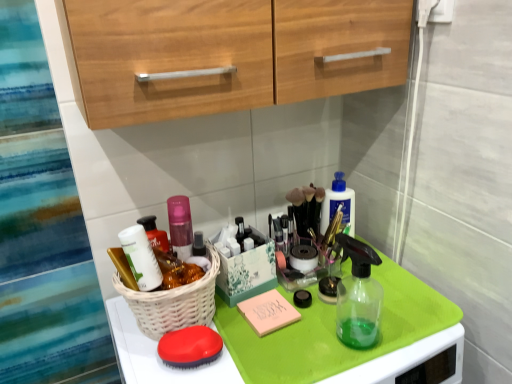
Identify the location of white wicker basket at center. (173, 303).

Measure the distance between point (145, 286) and camera.

Point (145, 286) and camera are 29.17 inches apart from each other.

In order to face matte white container at center left, should I rotate leftwards or rightwards?

To face it directly, rotate left by 15.046 degrees.

Identify the location of white wicker basket at center. The image size is (512, 384). (173, 303).

From a real-world perspective, is matte red brush at lower center physically below matte white container at center left?

Yes, from a real-world perspective, matte red brush at lower center is under matte white container at center left.

Where is `soap below the matte white container at center left (from the image's perspective)`? The height and width of the screenshot is (384, 512). soap below the matte white container at center left (from the image's perspective) is located at coordinates (190, 347).

Which of these two, matte red brush at lower center or matte white container at center left, stands taller?

matte white container at center left is taller.

Is matte red brush at lower center thinner than matte white container at center left?

No.

Who is taller, matte red brush at lower center or white wicker basket at center?

Standing taller between the two is white wicker basket at center.

Is matte red brush at lower center smaller than white wicker basket at center?

Correct, matte red brush at lower center occupies less space than white wicker basket at center.

Which is further, [189,349] or [155,316]?

The point [155,316] is behind.

Find the location of a particular element. Image resolution: width=512 pixels, height=384 pixels. basket that is on the left side of matte red brush at lower center is located at coordinates (173, 303).

Is matte white container at center left facing towards matte red brush at lower center?

No, matte white container at center left is not oriented towards matte red brush at lower center.

Considering the relative sizes of matte white container at center left and matte red brush at lower center in the image provided, is matte white container at center left bigger than matte red brush at lower center?

Yes.

You are a GUI agent. You are given a task and a screenshot of the screen. Output one action in this format:
    pyautogui.click(x=<x>, y=<y>)
    Task: Click on the soap that is on the right side of matte white container at center left
    
    Given the screenshot: What is the action you would take?
    pyautogui.click(x=190, y=347)

Measure the distance between matte white container at center left and matte red brush at lower center.

matte white container at center left and matte red brush at lower center are 5.28 inches apart from each other.

Which point is more distant from viewer, (157,339) or (142,275)?

The point (157,339) is farther from the camera.

Which object is more forward, white wicker basket at center or matte white container at center left?

white wicker basket at center is in front.

Is white wicker basket at center beside matte white container at center left?

Yes, white wicker basket at center and matte white container at center left clearly make contact.

Considering the sizes of objects white wicker basket at center and matte white container at center left in the image provided, who is taller, white wicker basket at center or matte white container at center left?

matte white container at center left is taller.

From the image's perspective, would you say matte white container at center left is shown under white wicker basket at center?

Incorrect, from the image's perspective, matte white container at center left is higher than white wicker basket at center.

Is matte white container at center left beside white wicker basket at center?

Yes, matte white container at center left is with white wicker basket at center.

Between matte white container at center left and white wicker basket at center, which one has larger size?

Bigger between the two is white wicker basket at center.

Measure the distance from matte white container at center left to white wicker basket at center.

The distance of matte white container at center left from white wicker basket at center is 2.61 inches.

In the scene shown: Which is in front, white wicker basket at center or matte red brush at lower center?

white wicker basket at center.

You are a GUI agent. You are given a task and a screenshot of the screen. Output one action in this format:
    pyautogui.click(x=<x>, y=<y>)
    Task: Click on the soap below the white wicker basket at center (from a real-world perspective)
    
    Given the screenshot: What is the action you would take?
    pyautogui.click(x=190, y=347)

Is white wicker basket at center spatially inside matte red brush at lower center, or outside of it?

white wicker basket at center is spatially situated outside matte red brush at lower center.

Considering the relative sizes of white wicker basket at center and matte red brush at lower center in the image provided, is white wicker basket at center shorter than matte red brush at lower center?

In fact, white wicker basket at center may be taller than matte red brush at lower center.

This screenshot has height=384, width=512. Identify the location of toiletry located above the matte red brush at lower center (from the image's perspective). (141, 258).

Where is `soap below the white wicker basket at center (from a real-world perspective)`? The height and width of the screenshot is (384, 512). soap below the white wicker basket at center (from a real-world perspective) is located at coordinates (190, 347).

From the image, which object appears to be farther from matte white container at center left, white wicker basket at center or matte red brush at lower center?

Based on the image, matte red brush at lower center appears to be further to matte white container at center left.

Estimate the real-world distances between objects in this image. Which object is closer to white wicker basket at center, matte white container at center left or matte red brush at lower center?

matte red brush at lower center is positioned closer to the anchor white wicker basket at center.

Estimate the real-world distances between objects in this image. Which object is further from matte red brush at lower center, white wicker basket at center or matte white container at center left?

matte white container at center left is further to matte red brush at lower center.

Based on their spatial positions, is matte red brush at lower center or matte white container at center left closer to white wicker basket at center?

matte red brush at lower center is positioned closer to the anchor white wicker basket at center.

Estimate the real-world distances between objects in this image. Which object is further from matte white container at center left, matte red brush at lower center or white wicker basket at center?

matte red brush at lower center is further to matte white container at center left.

Which object lies further to the anchor point matte red brush at lower center, matte white container at center left or white wicker basket at center?

Among the two, matte white container at center left is located further to matte red brush at lower center.

Where is `basket between matte white container at center left and matte red brush at lower center from top to bottom`? The width and height of the screenshot is (512, 384). basket between matte white container at center left and matte red brush at lower center from top to bottom is located at coordinates (173, 303).